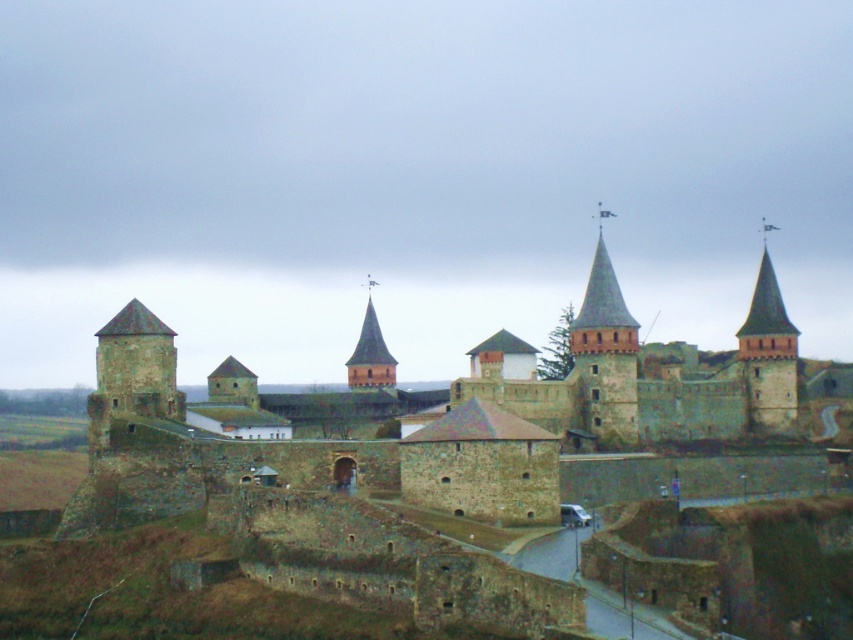
Question: Which of these objects is positioned closest to the rustic stone castle at center?

Choices:
 (A) brick stonework tower at center
 (B) smooth stone spire at upper right

Answer: (B)

Question: Can you confirm if smooth stone spire at upper right is positioned to the right of brick stonework tower at center?

Choices:
 (A) no
 (B) yes

Answer: (B)

Question: Is the position of rustic stone castle at center less distant than that of brick stonework tower at center?

Choices:
 (A) no
 (B) yes

Answer: (B)

Question: Can you confirm if smooth stone spire at upper right is positioned to the left of brick stonework tower at center?

Choices:
 (A) yes
 (B) no

Answer: (B)

Question: Among these objects, which one is nearest to the camera?

Choices:
 (A) rustic stone castle at center
 (B) smooth stone spire at upper right

Answer: (A)

Question: Estimate the real-world distances between objects in this image. Which object is farther from the brick stonework tower at center?

Choices:
 (A) smooth stone spire at upper right
 (B) rustic stone castle at center

Answer: (A)